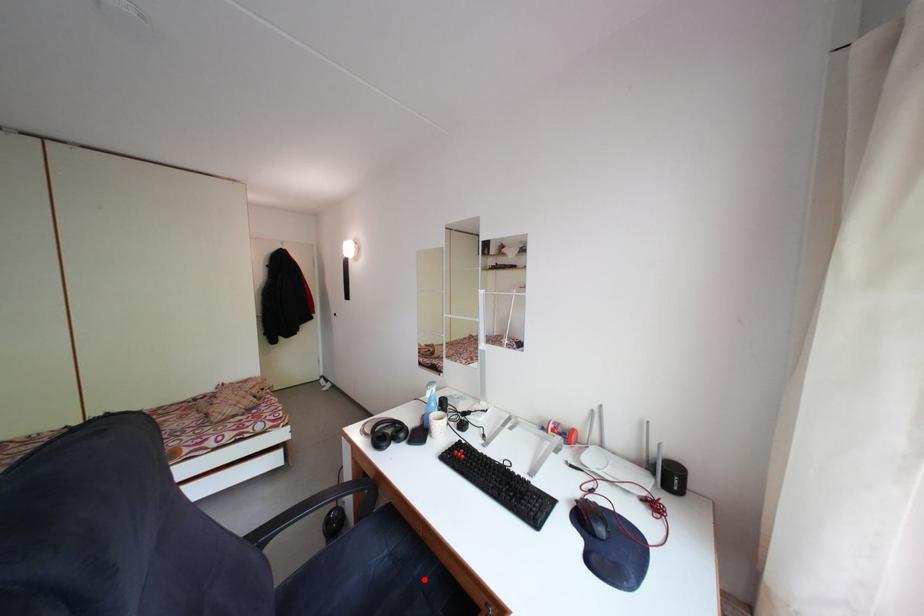
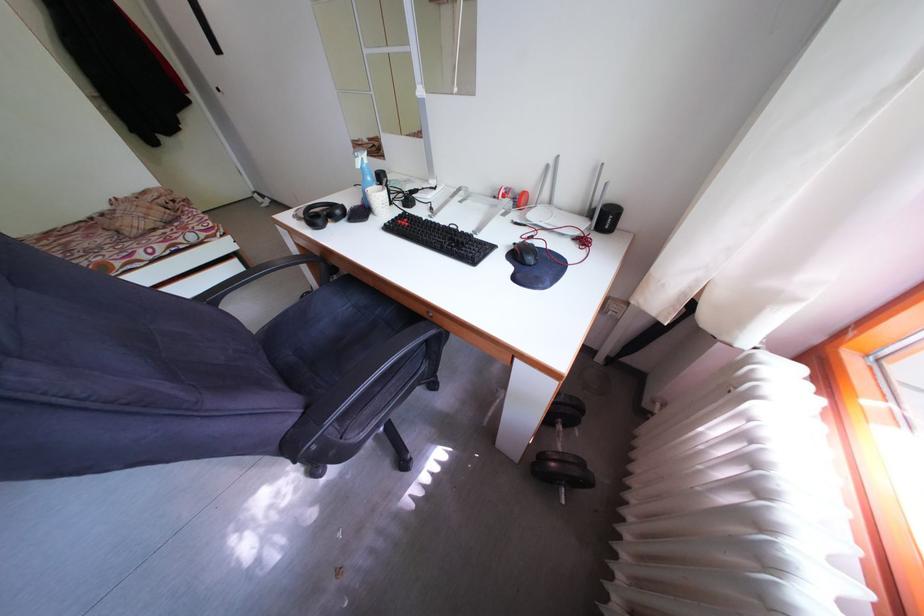
Question: I am providing you with two images of the same scene from different viewpoints. Image1 has a red point marked. In image2, the corresponding 3D location appears at what relative position? Reply with the corresponding letter.

Choices:
 (A) Closer
 (B) Farther

Answer: (B)